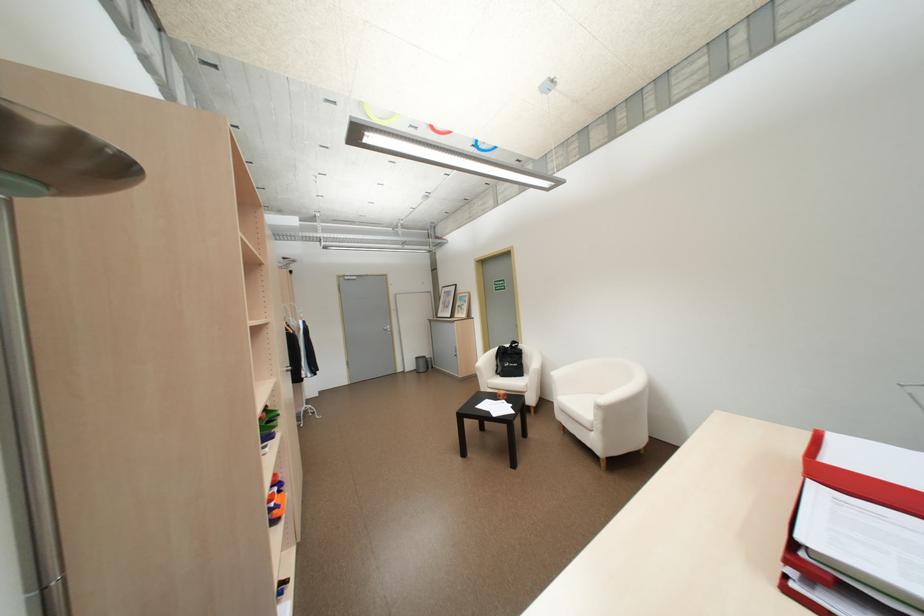
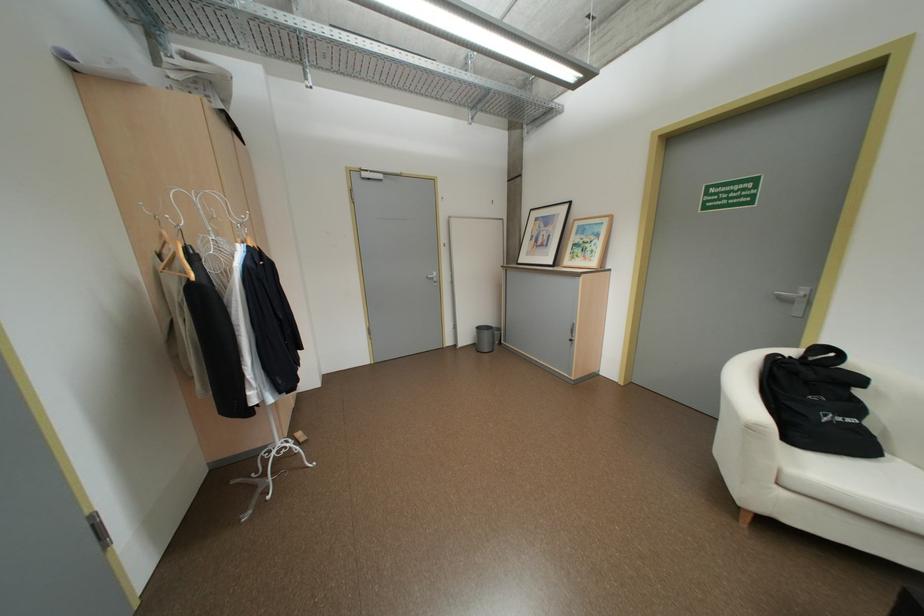
The images are taken continuously from a first-person perspective. In which direction are you moving?

The movement direction of the cameraman is left, forward.